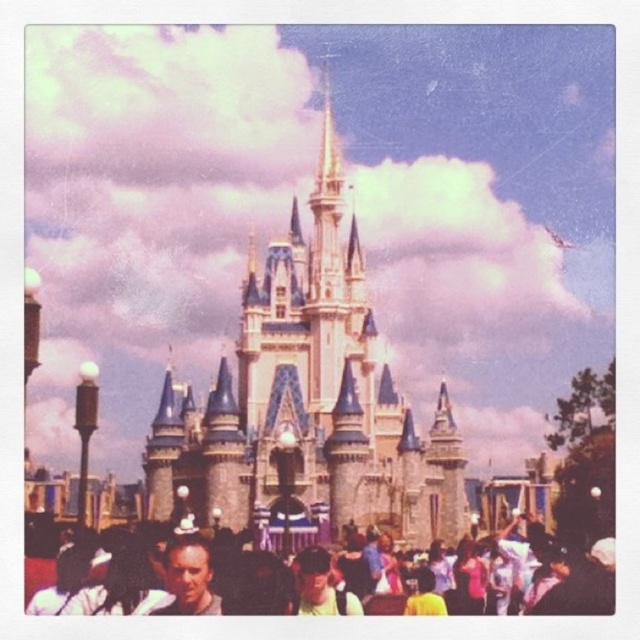
Question: Which point appears farthest from the camera in this image?

Choices:
 (A) (253, 333)
 (B) (188, 541)
 (C) (320, 579)

Answer: (A)

Question: Can you confirm if multicolored fabric crowd at lower center is bigger than matte yellow shirt at center?

Choices:
 (A) no
 (B) yes

Answer: (B)

Question: Can you confirm if light brown hair at lower center is bigger than matte yellow shirt at center?

Choices:
 (A) yes
 (B) no

Answer: (A)

Question: Among these objects, which one is nearest to the camera?

Choices:
 (A) light brown hair at lower center
 (B) multicolored fabric crowd at lower center

Answer: (A)

Question: From the image, what is the correct spatial relationship of white stone castle at center in relation to matte yellow shirt at center?

Choices:
 (A) right
 (B) left

Answer: (B)

Question: Which of the following is the farthest from the observer?

Choices:
 (A) (221, 356)
 (B) (196, 609)
 (C) (301, 595)

Answer: (A)